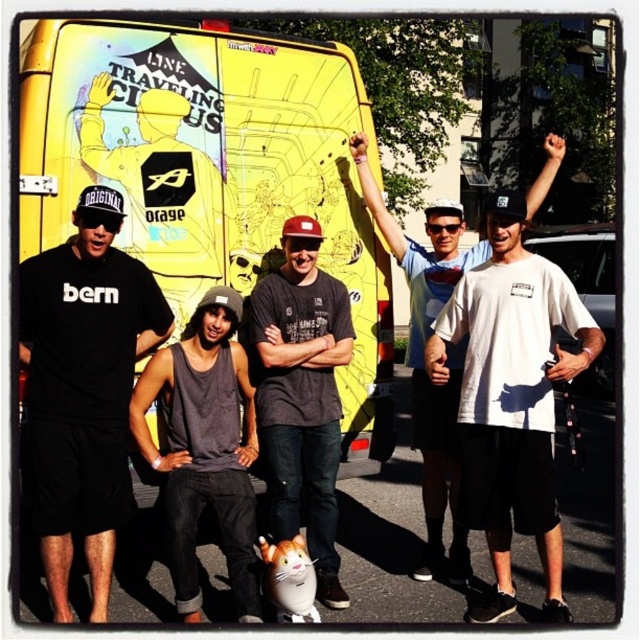
Question: From the image, what is the correct spatial relationship of yellow matte van at center in relation to white matte t-shirt at center?

Choices:
 (A) above
 (B) below

Answer: (A)

Question: Does yellow matte van at center have a lesser width compared to black matte t-shirt at left?

Choices:
 (A) no
 (B) yes

Answer: (A)

Question: Which point is farther to the camera?

Choices:
 (A) white matte t-shirt at center
 (B) black matte t-shirt at left
 (C) gray tank top at center

Answer: (A)

Question: Among these objects, which one is nearest to the camera?

Choices:
 (A) dark gray t-shirt at center
 (B) yellow matte van at center

Answer: (B)

Question: Is dark gray t-shirt at center smaller than white matte t-shirt at center?

Choices:
 (A) yes
 (B) no

Answer: (A)

Question: Estimate the real-world distances between objects in this image. Which object is closer to the dark gray t-shirt at center?

Choices:
 (A) white matte t-shirt at center
 (B) yellow matte van at center
 (C) gray tank top at center
 (D) black matte t-shirt at left

Answer: (C)